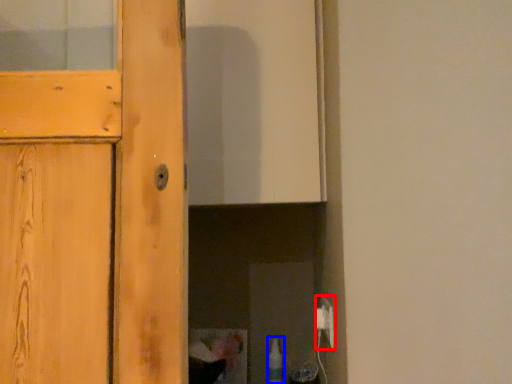
Question: Which object is further to the camera taking this photo, electric outlet (highlighted by a red box) or bottle (highlighted by a blue box)?

Choices:
 (A) electric outlet
 (B) bottle

Answer: (B)